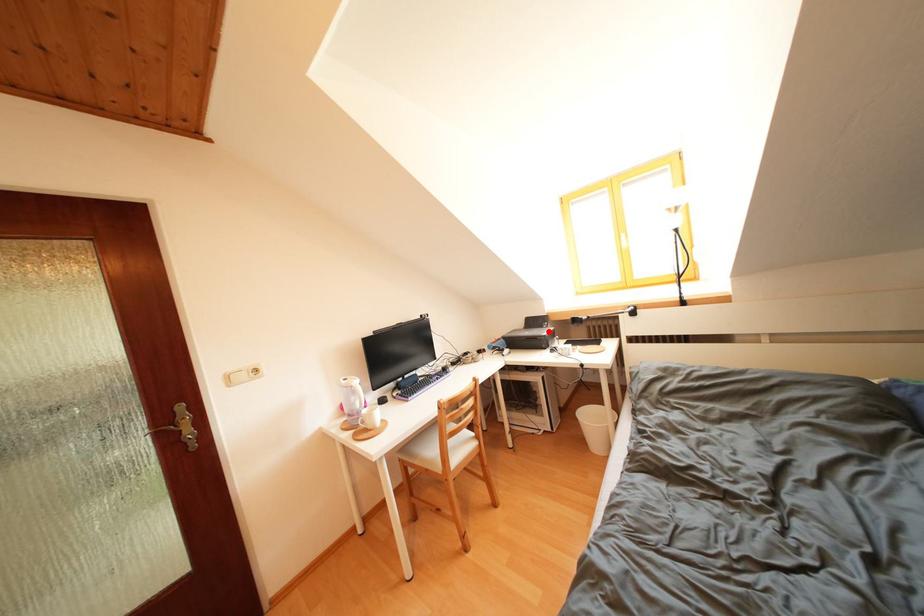
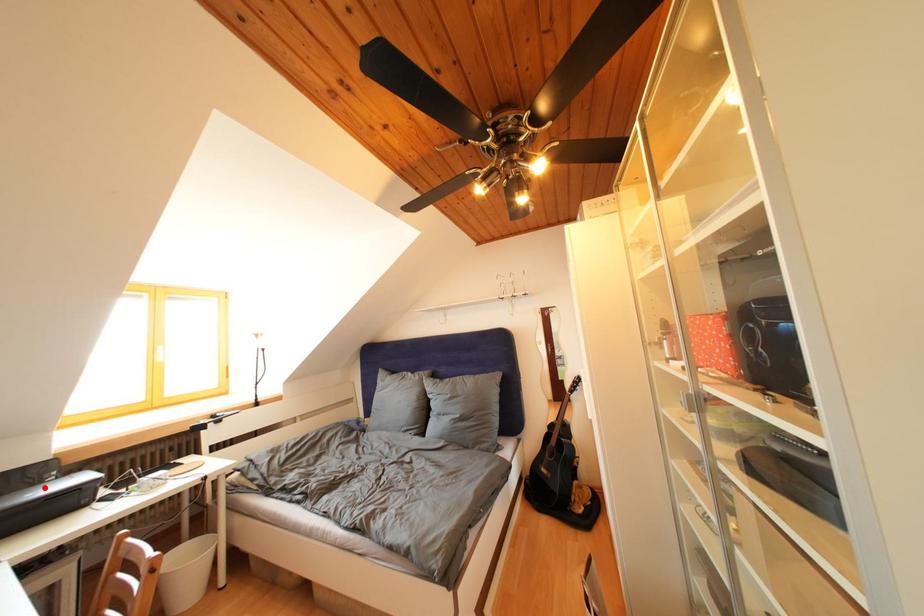
I am providing you with two images of the same scene from different viewpoints. A red point is marked on the first image and another point is marked on the second image. Are the points marked in image1 and image2 representing the same 3D position?

Yes